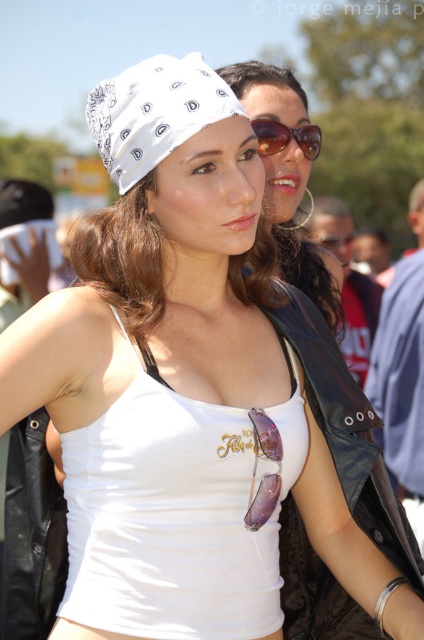
Does shiny black leather jacket at center have a smaller size compared to matte black sunglasses at upper center?

Correct, shiny black leather jacket at center occupies less space than matte black sunglasses at upper center.

Is point (404, 513) closer to viewer compared to point (292, 193)?

Yes, it is.

Who is more distant from viewer, (357,424) or (281,225)?

Point (281,225)

In order to click on shiny black leather jacket at center in this screenshot , I will do `click(346, 428)`.

Is shiny black leather jacket at center to the right of white printed bandana at upper center from the viewer's perspective?

Yes, shiny black leather jacket at center is to the right of white printed bandana at upper center.

Consider the image. Who is taller, shiny black leather jacket at center or white printed bandana at upper center?

Standing taller between the two is shiny black leather jacket at center.

Locate an element on the screen. The image size is (424, 640). shiny black leather jacket at center is located at coordinates (346, 428).

Is white printed bandana at upper center to the right of sunglasses at center from the viewer's perspective?

In fact, white printed bandana at upper center is to the left of sunglasses at center.

Which is in front, point (150, 104) or point (298, 140)?

Point (150, 104)

Describe the element at coordinates (155, 113) in the screenshot. I see `white printed bandana at upper center` at that location.

You are a GUI agent. You are given a task and a screenshot of the screen. Output one action in this format:
    pyautogui.click(x=<x>, y=<y>)
    Task: Click on the white printed bandana at upper center
    Image resolution: width=424 pixels, height=640 pixels.
    Given the screenshot: What is the action you would take?
    pyautogui.click(x=155, y=113)